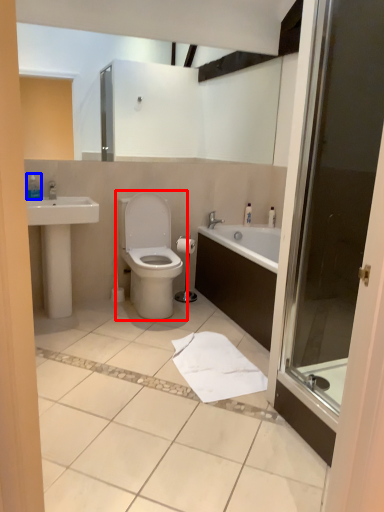
Question: Among these objects, which one is nearest to the camera, toilet (highlighted by a red box) or toiletry (highlighted by a blue box)?

Choices:
 (A) toilet
 (B) toiletry

Answer: (A)